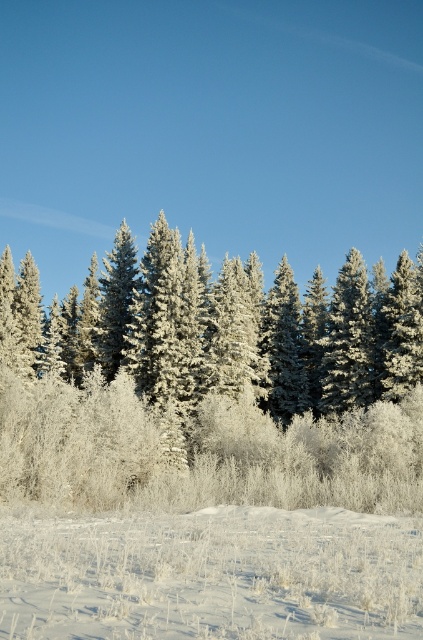
Which is in front, point (203, 352) or point (109, 524)?

Point (109, 524) is in front.

The width and height of the screenshot is (423, 640). I want to click on frosted pine trees at center, so click(206, 384).

Is point (69, 486) positioned after point (181, 625)?

Yes.

Where is `frosted pine trees at center`? frosted pine trees at center is located at coordinates (206, 384).